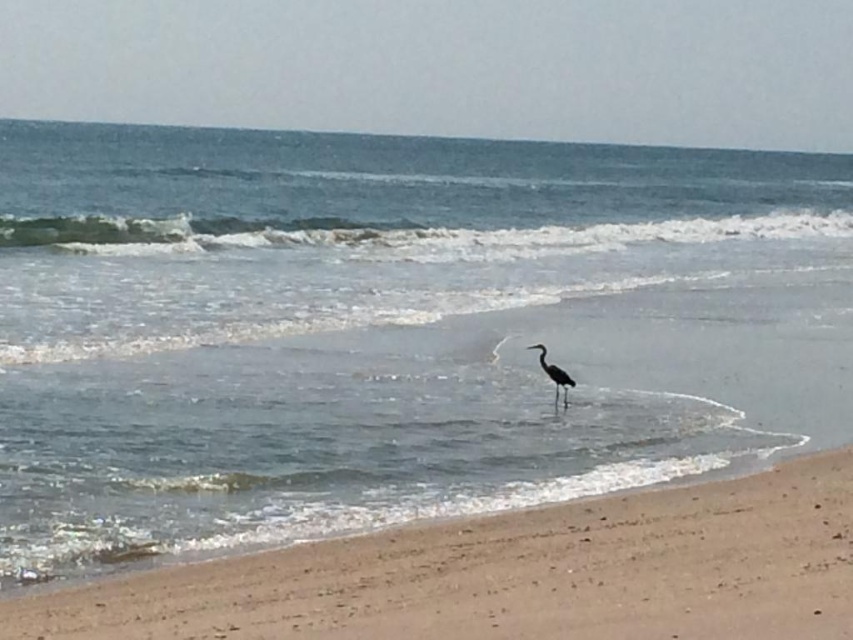
Does point (432, 636) lie behind point (564, 380)?

No, it is not.

Is sandy beach at lower right to the right of gray matte heron at center from the viewer's perspective?

No, sandy beach at lower right is not to the right of gray matte heron at center.

Does point (468, 602) come closer to viewer compared to point (552, 376)?

Yes, it is.

Where is `sandy beach at lower right`? sandy beach at lower right is located at coordinates (514, 573).